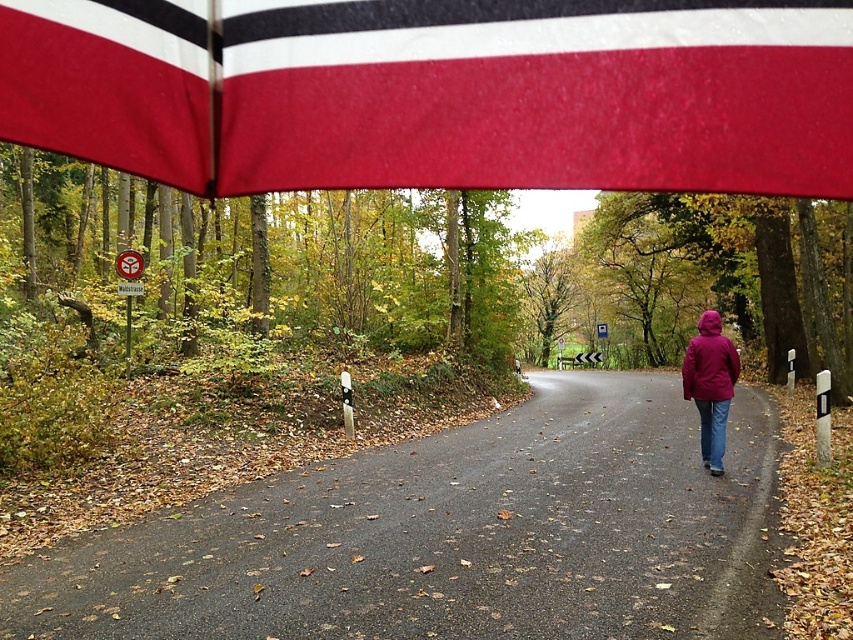
Question: Which of the following is the farthest from the observer?

Choices:
 (A) brown asphalt road at center
 (B) matte purple jacket at right

Answer: (B)

Question: Does red fabric flag at upper center have a larger size compared to matte purple jacket at right?

Choices:
 (A) no
 (B) yes

Answer: (A)

Question: Based on their relative distances, which object is farther from the brown asphalt road at center?

Choices:
 (A) matte purple jacket at right
 (B) red fabric flag at upper center

Answer: (B)

Question: In this image, where is red fabric flag at upper center located relative to brown asphalt road at center?

Choices:
 (A) below
 (B) above

Answer: (B)

Question: Which object appears farthest from the camera in this image?

Choices:
 (A) matte purple jacket at right
 (B) brown asphalt road at center
 (C) red fabric flag at upper center

Answer: (A)

Question: Can you confirm if red fabric flag at upper center is positioned above brown asphalt road at center?

Choices:
 (A) no
 (B) yes

Answer: (B)